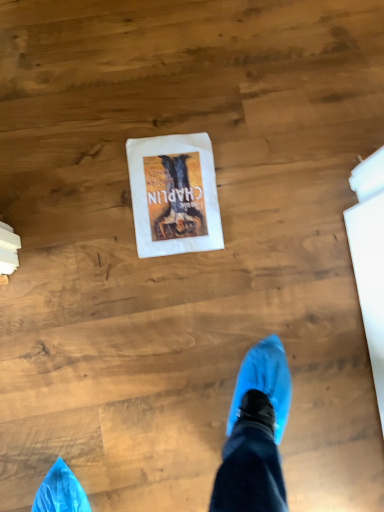
Locate an element on the screen. The image size is (384, 512). vacant space behind white paper at center is located at coordinates click(x=207, y=112).